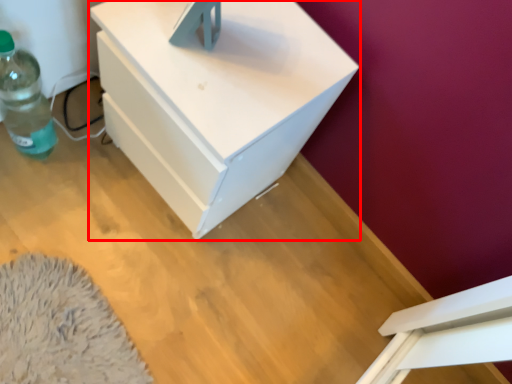
Question: From the image, what is the correct spatial relationship of nightstand (annotated by the red box) in relation to bottle?

Choices:
 (A) right
 (B) left

Answer: (A)